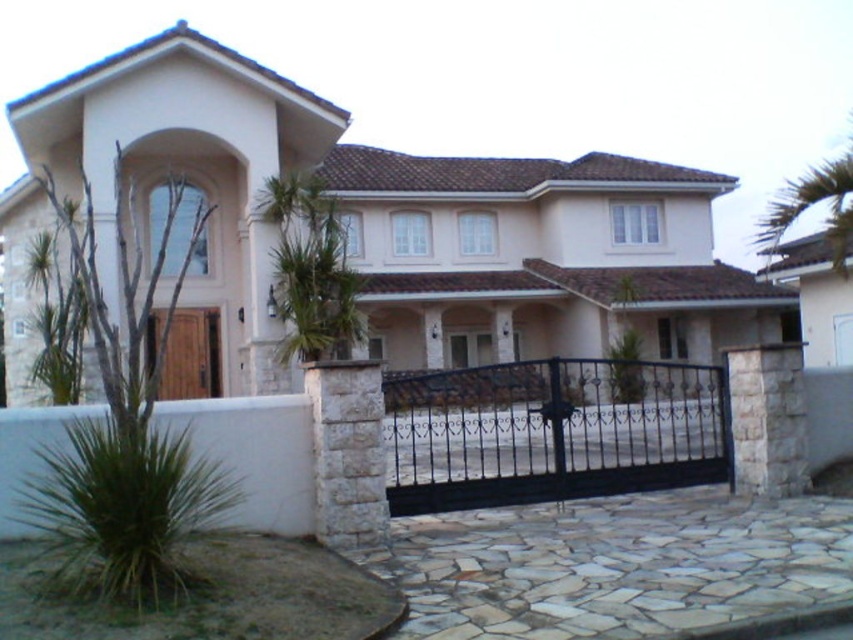
You are a delivery person arriving at the house. You need to park your van which is 2 meters wide. The natural stone driveway at center and the green leafy palm tree at center are in your path. Can you fit your van between them without damaging either?

The natural stone driveway at center is wider than the green leafy palm tree at center. Since the driveway is wider, you can safely park your van between them as the driveway provides enough space for the van to pass through without damaging the tree.